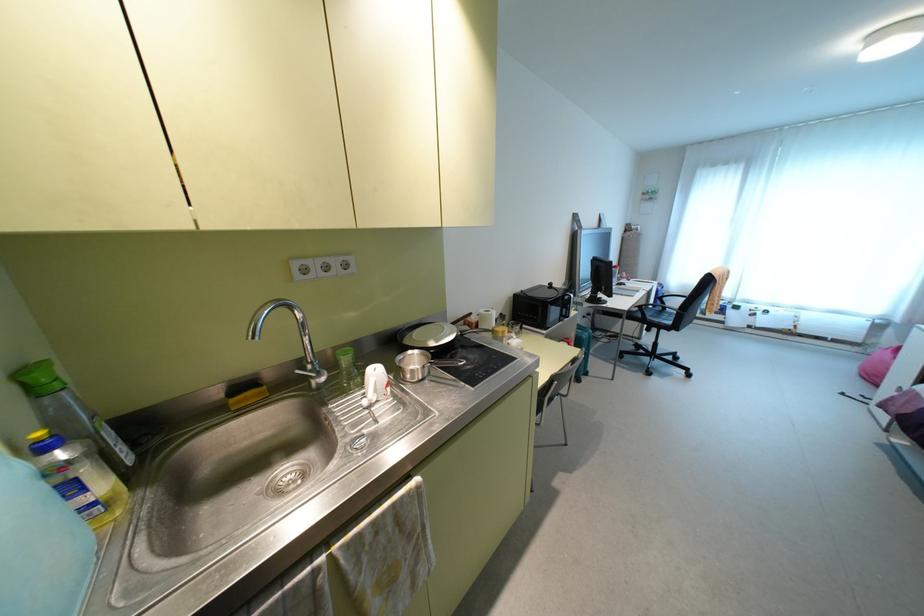
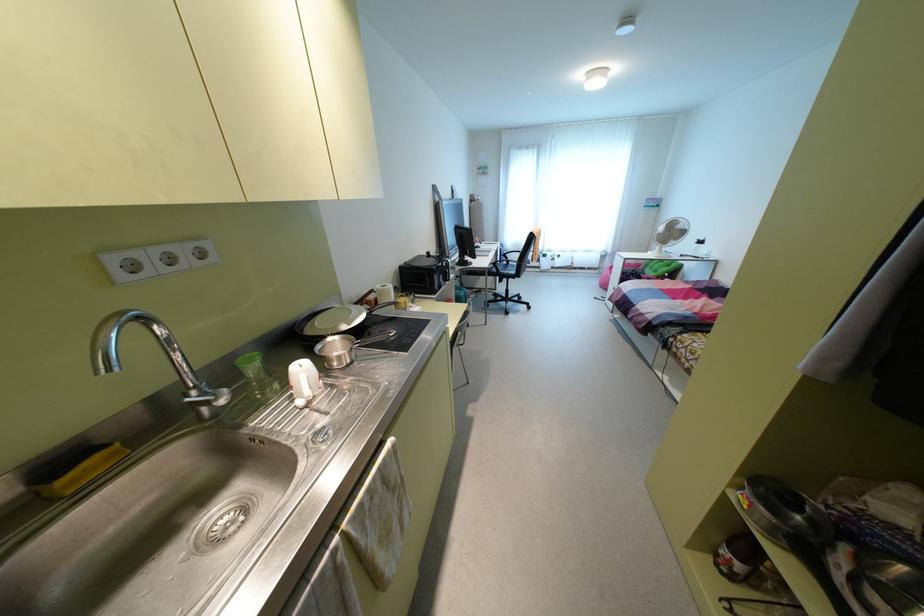
Locate, in the second image, the point that corresponds to (334,262) in the first image.

(181, 251)